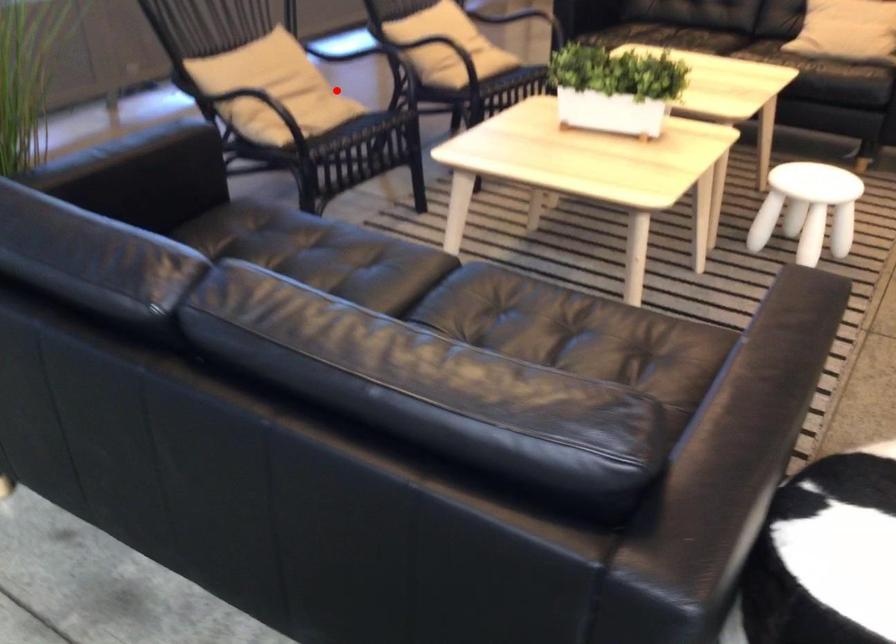
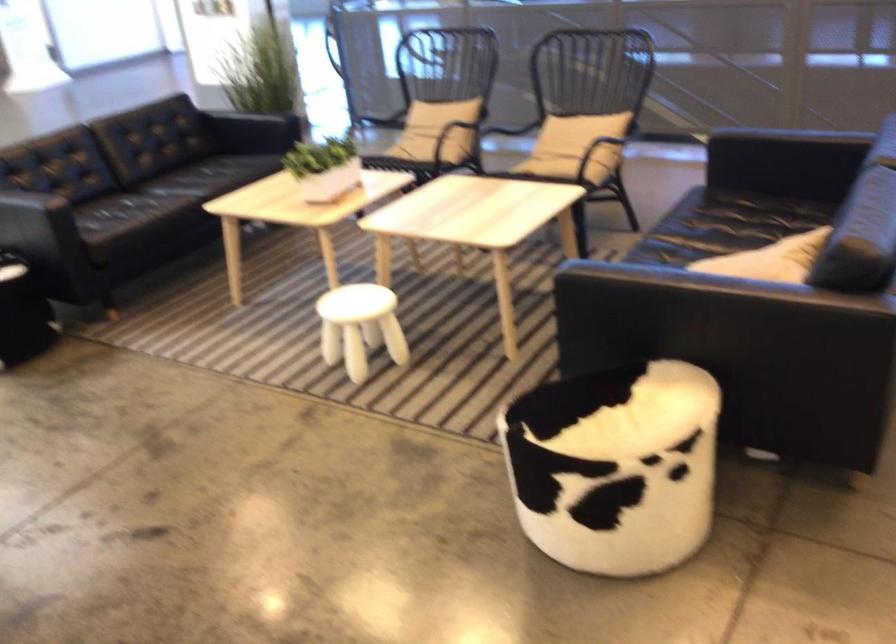
Locate, in the second image, the point that corresponds to the highlighted location in the first image.

(450, 135)